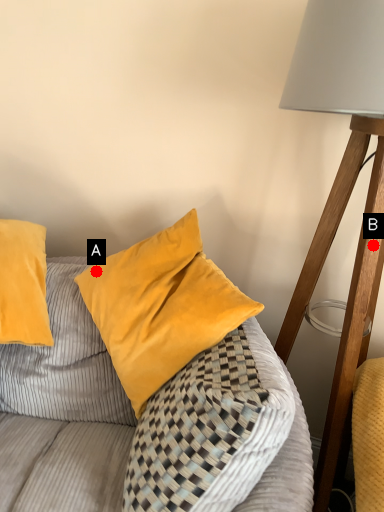
Question: Two points are circled on the image, labeled by A and B beside each circle. Which point is further to the camera?

Choices:
 (A) A is further
 (B) B is further

Answer: (A)